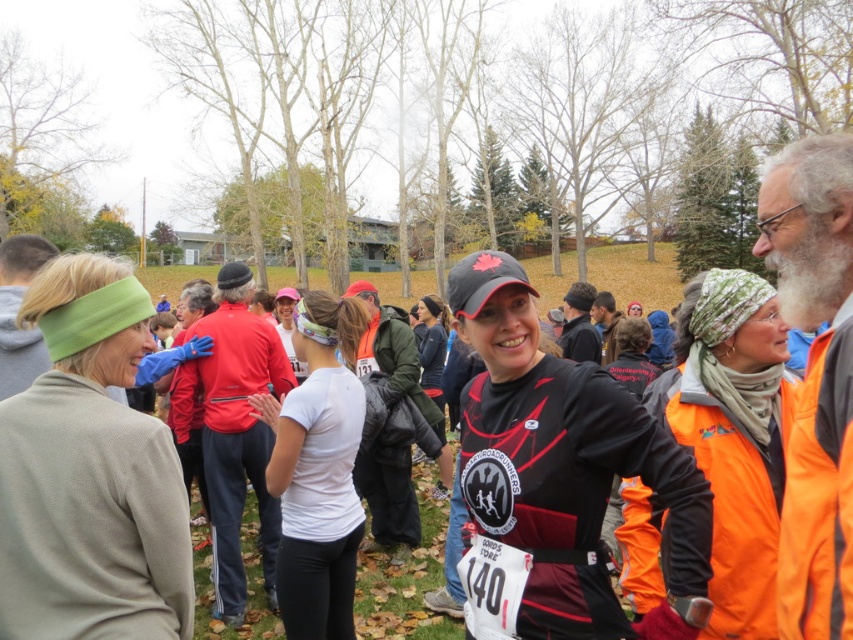
Question: Among these points, which one is nearest to the camera?

Choices:
 (A) (584, 529)
 (B) (318, 346)

Answer: (A)

Question: Which object appears closest to the camera in this image?

Choices:
 (A) black matte running shirt at center
 (B) white matte t-shirt at center

Answer: (A)

Question: Is black matte running shirt at center thinner than white matte t-shirt at center?

Choices:
 (A) yes
 (B) no

Answer: (B)

Question: Where is black matte running shirt at center located in relation to white matte t-shirt at center in the image?

Choices:
 (A) above
 (B) below

Answer: (A)

Question: Among these objects, which one is farthest from the camera?

Choices:
 (A) black matte running shirt at center
 (B) white matte t-shirt at center

Answer: (B)

Question: Can you confirm if black matte running shirt at center is positioned to the left of white matte t-shirt at center?

Choices:
 (A) no
 (B) yes

Answer: (A)